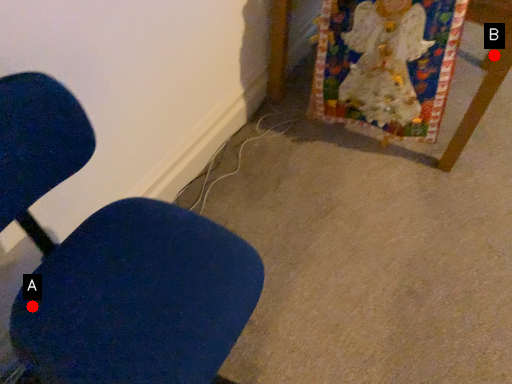
Question: Two points are circled on the image, labeled by A and B beside each circle. Which point appears farthest from the camera in this image?

Choices:
 (A) A is further
 (B) B is further

Answer: (B)